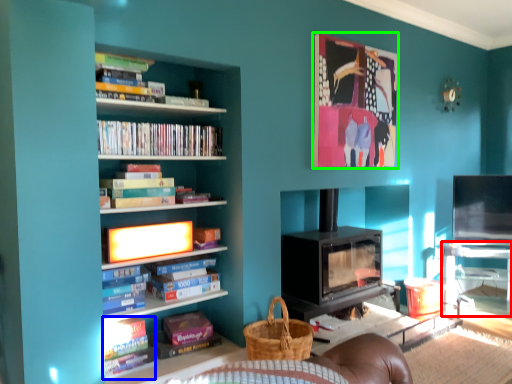
Question: Based on their relative distances, which object is nearer to table (highlighted by a red box)? Choose from book (highlighted by a blue box) and picture frame (highlighted by a green box).

Choices:
 (A) book
 (B) picture frame

Answer: (B)